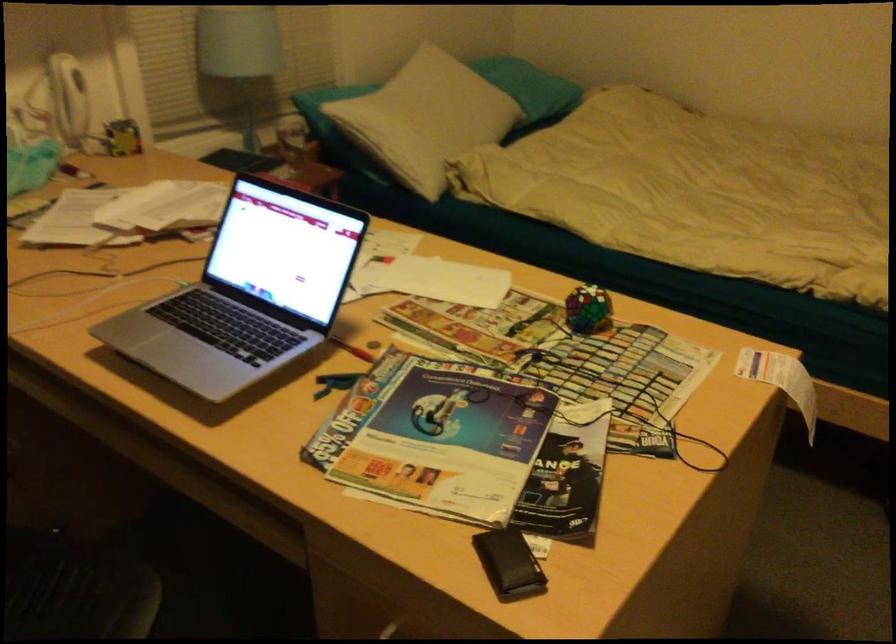
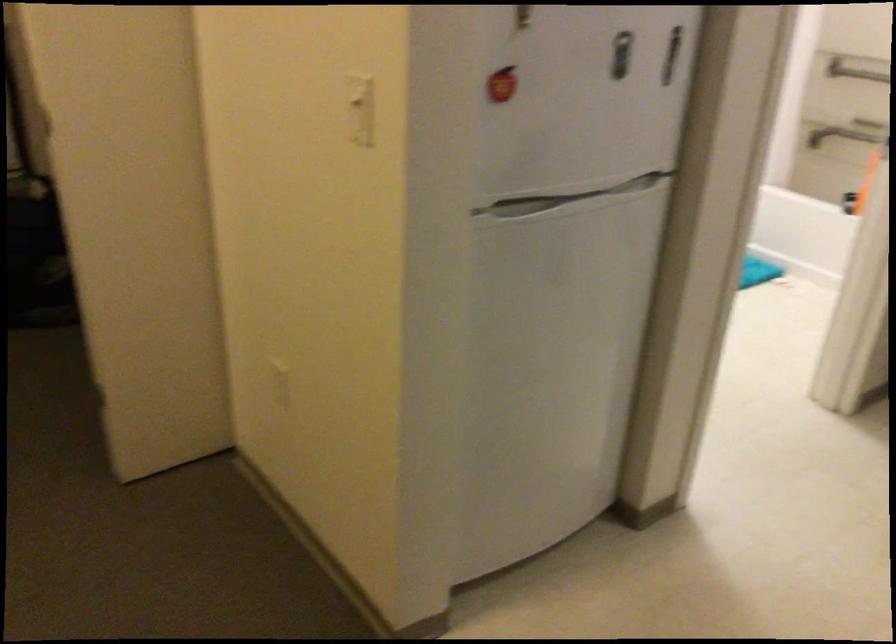
First-person continuous shooting, in which direction is the camera rotating?

The rotation direction of the camera is right-down.